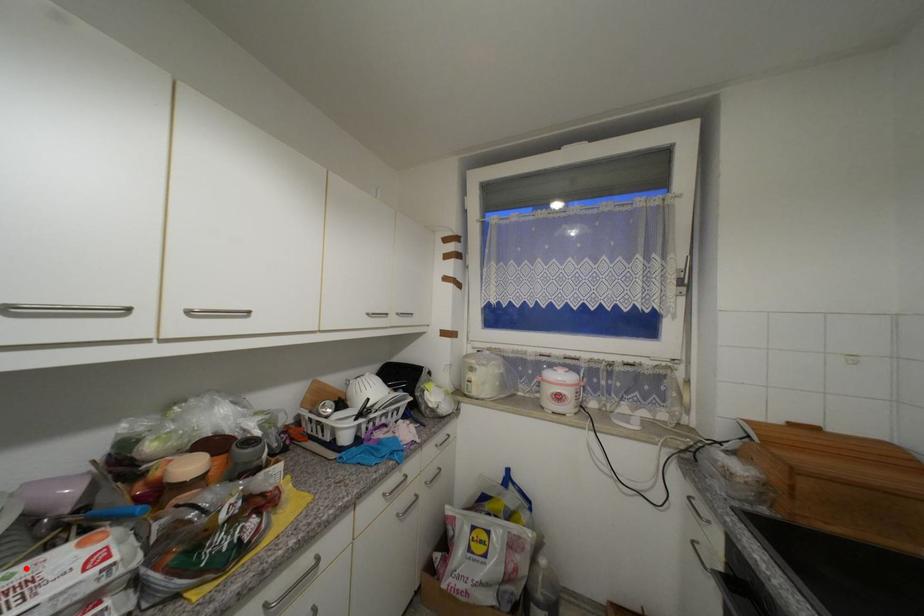
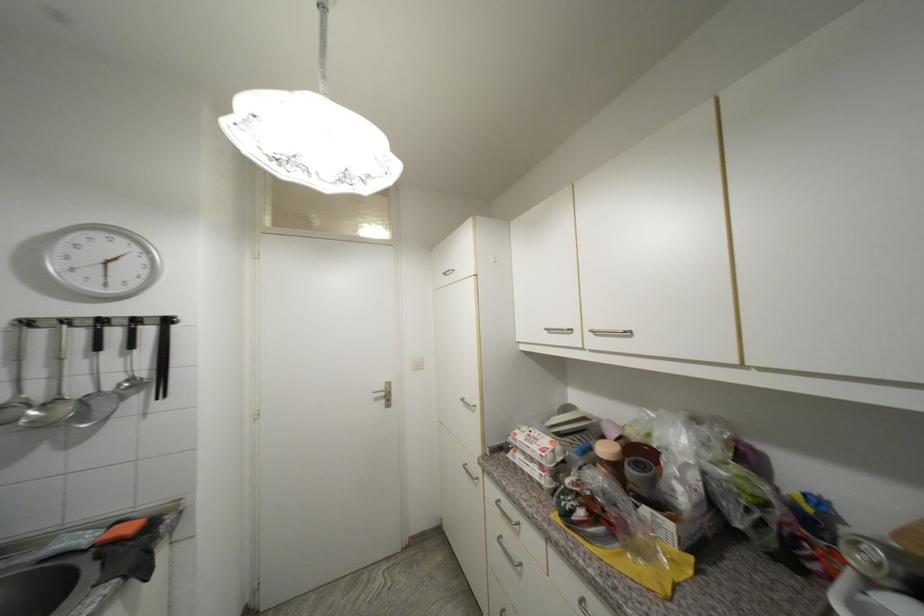
In the second image, find the point that corresponds to the highlighted location in the first image.

(548, 436)